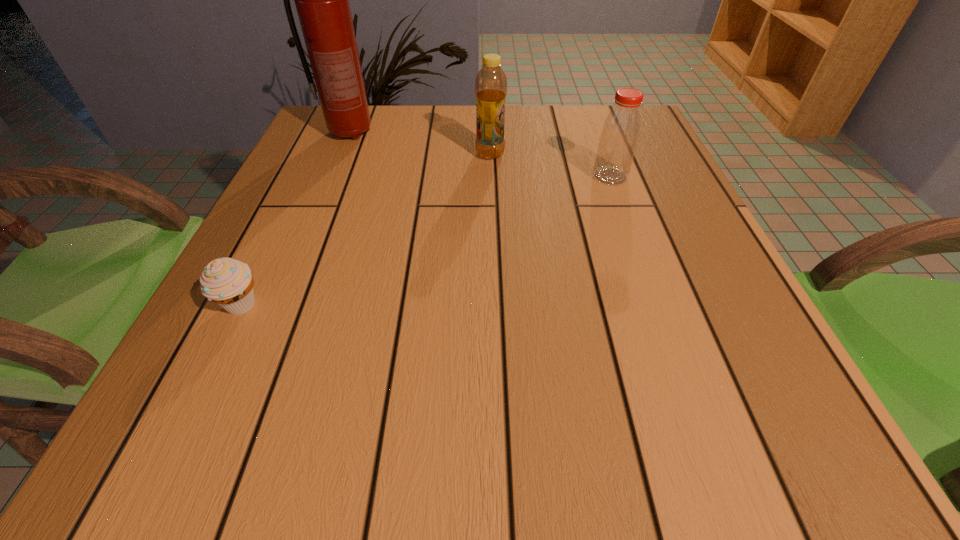
Locate an element on the screen. This screenshot has width=960, height=540. vacant position located on the back of the second nearest object is located at coordinates (585, 107).

Find the location of a particular element. vacant area situated 0.370m on the right of the shortest object is located at coordinates (496, 306).

The width and height of the screenshot is (960, 540). I want to click on fire extinguisher that is at the far edge, so click(x=322, y=0).

Locate an element on the screen. This screenshot has height=540, width=960. bottle that is at the far edge is located at coordinates (491, 83).

The height and width of the screenshot is (540, 960). What are the coordinates of `fire extinguisher that is at the left edge` in the screenshot? It's located at (322, 0).

Identify the location of muffin positioned at the left edge. The width and height of the screenshot is (960, 540). (228, 282).

Where is `object at the right edge`? object at the right edge is located at coordinates (621, 129).

Locate an element on the screen. This screenshot has height=540, width=960. object located at the far left corner is located at coordinates tap(322, 0).

Locate an element on the screen. This screenshot has width=960, height=540. vacant region at the far edge of the desktop is located at coordinates (524, 131).

Identify the location of free space at the near edge of the desktop. Image resolution: width=960 pixels, height=540 pixels. (653, 430).